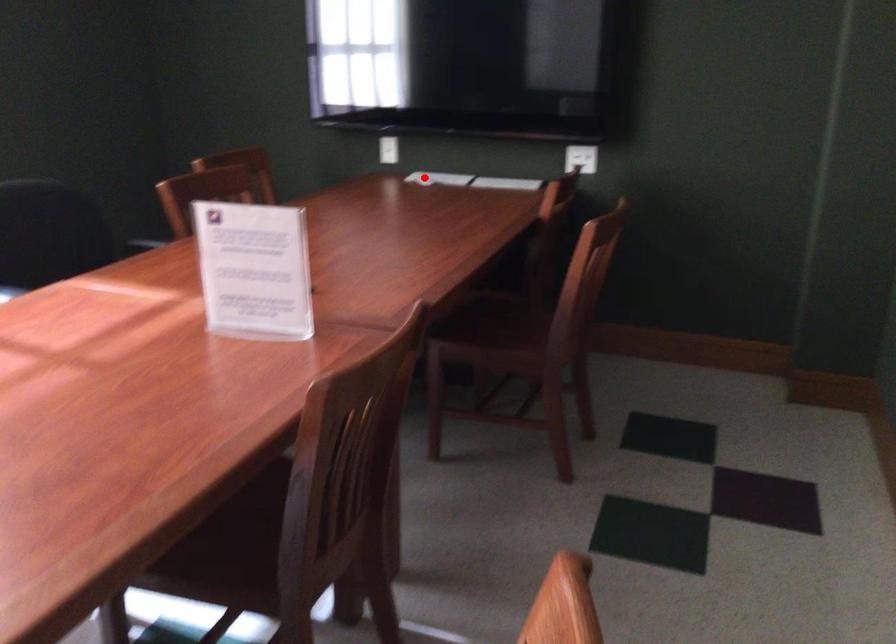
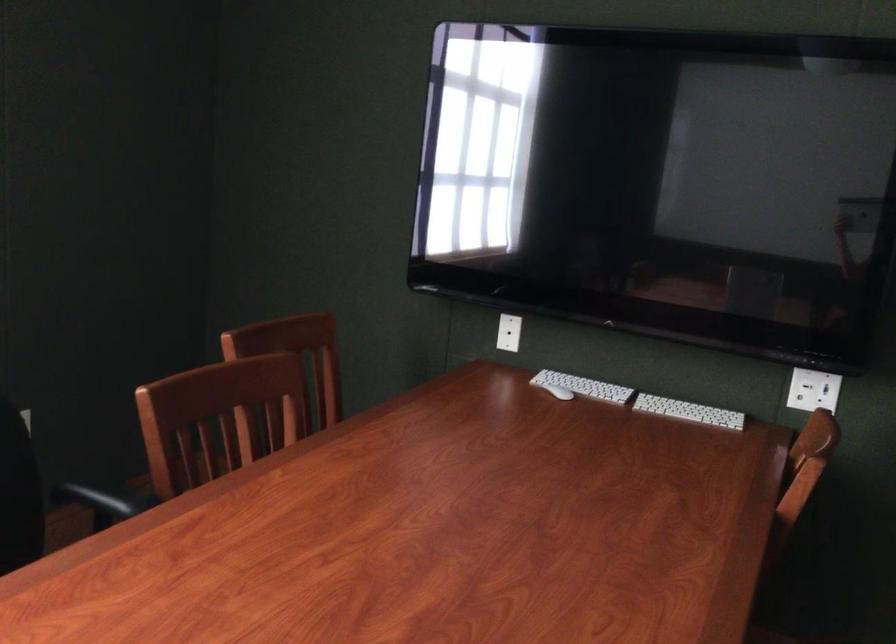
Question: I am providing you with two images of the same scene from different viewpoints. Image1 has a red point marked. In image2, the corresponding 3D location appears at what relative position? Reply with the corresponding letter.

Choices:
 (A) Closer
 (B) Farther

Answer: (A)